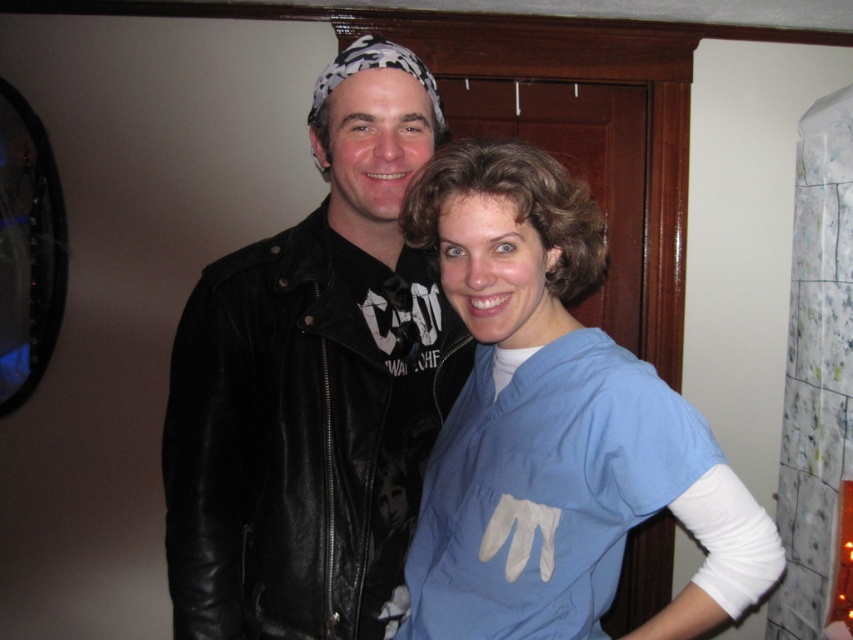
You are standing at the origin point in the room. There are two points marked in the image, point [421,122] and point [653,378]. Which point is closer to you?

Point [653,378] is closer to you because it is in front of point [421,122].